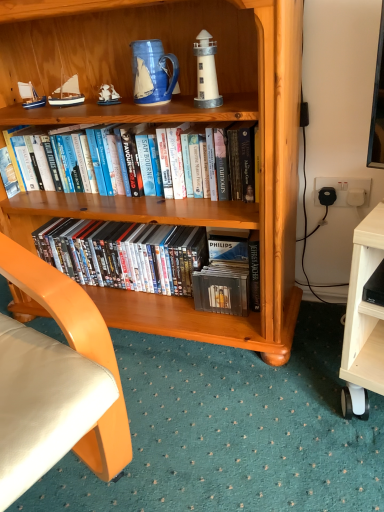
Question: From the image's perspective, is blue matte sailboat at upper left, which is the first sailboat in left-to-right order, on hardcover books at center, which is the 2th book in bottom-to-top order?

Choices:
 (A) yes
 (B) no

Answer: (A)

Question: Does blue matte sailboat at upper left, which is the first sailboat in left-to-right order, come behind hardcover books at center, which is the 2th book in bottom-to-top order?

Choices:
 (A) yes
 (B) no

Answer: (A)

Question: Is blue matte sailboat at upper left, acting as the second sailboat starting from the right, looking in the opposite direction of hardcover books at center, positioned as the first book in top-to-bottom order?

Choices:
 (A) yes
 (B) no

Answer: (B)

Question: Does blue matte sailboat at upper left, acting as the second sailboat starting from the right, appear on the left side of hardcover books at center, positioned as the first book in top-to-bottom order?

Choices:
 (A) yes
 (B) no

Answer: (A)

Question: Is hardcover books at center, which is the 2th book in bottom-to-top order, surrounded by blue matte sailboat at upper left, acting as the second sailboat starting from the right?

Choices:
 (A) no
 (B) yes

Answer: (A)

Question: Can you confirm if blue matte sailboat at upper left, which is the first sailboat in left-to-right order, is bigger than hardcover books at center, which is the 2th book in bottom-to-top order?

Choices:
 (A) yes
 (B) no

Answer: (B)

Question: Considering the relative positions of wooden bookcase at center and wooden sailboat at upper left, which is the 2th sailboat from left to right, in the image provided, is wooden bookcase at center behind wooden sailboat at upper left, which is the 2th sailboat from left to right,?

Choices:
 (A) no
 (B) yes

Answer: (A)

Question: From a real-world perspective, is wooden bookcase at center beneath wooden sailboat at upper left, which is the 2th sailboat from left to right?

Choices:
 (A) no
 (B) yes

Answer: (B)

Question: Does wooden bookcase at center contain wooden sailboat at upper left, which is the 2th sailboat from left to right?

Choices:
 (A) no
 (B) yes

Answer: (B)

Question: From a real-world perspective, does wooden bookcase at center stand above wooden sailboat at upper left, which is the 2th sailboat from left to right?

Choices:
 (A) yes
 (B) no

Answer: (B)

Question: From the image's perspective, is wooden bookcase at center beneath wooden sailboat at upper left, the 1th sailboat when ordered from right to left?

Choices:
 (A) no
 (B) yes

Answer: (B)

Question: From the image's perspective, would you say wooden bookcase at center is positioned over wooden sailboat at upper left, which is the 2th sailboat from left to right?

Choices:
 (A) yes
 (B) no

Answer: (B)

Question: Considering the relative sizes of wooden sailboat at upper left, the 1th sailboat when ordered from right to left, and wooden bookcase at center in the image provided, is wooden sailboat at upper left, the 1th sailboat when ordered from right to left, shorter than wooden bookcase at center?

Choices:
 (A) yes
 (B) no

Answer: (A)